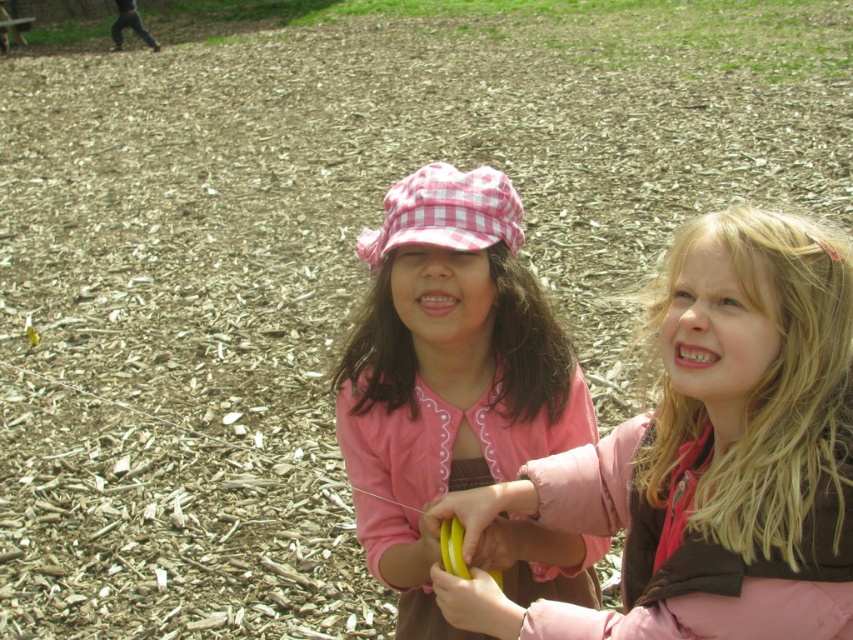
Question: Can you confirm if pink fabric jacket at center is positioned to the right of pink gingham hat at center?

Choices:
 (A) yes
 (B) no

Answer: (A)

Question: Which object is positioned closest to the yellow rubber banana at center?

Choices:
 (A) pink gingham hat at center
 (B) pink fabric jacket at center

Answer: (A)

Question: Which of these objects is positioned closest to the pink fabric jacket at center?

Choices:
 (A) pink gingham hat at center
 (B) yellow rubber banana at center

Answer: (B)

Question: Is the position of pink fabric jacket at center more distant than that of yellow rubber banana at center?

Choices:
 (A) yes
 (B) no

Answer: (B)

Question: Can you confirm if pink fabric jacket at center is positioned to the left of yellow rubber banana at center?

Choices:
 (A) yes
 (B) no

Answer: (B)

Question: Which object is farther from the camera taking this photo?

Choices:
 (A) pink gingham hat at center
 (B) pink fabric jacket at center
 (C) yellow rubber banana at center

Answer: (A)